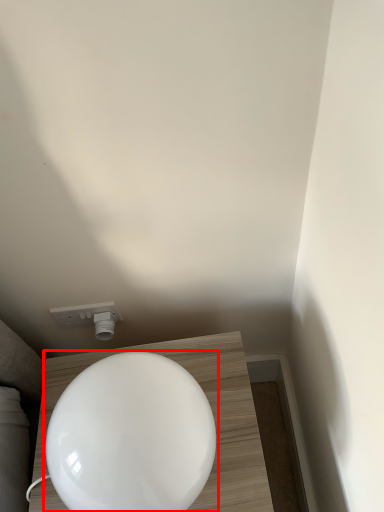
Question: From the image's perspective, what is the correct spatial positioning of toilet (annotated by the red box) in reference to light fixture?

Choices:
 (A) below
 (B) above

Answer: (A)